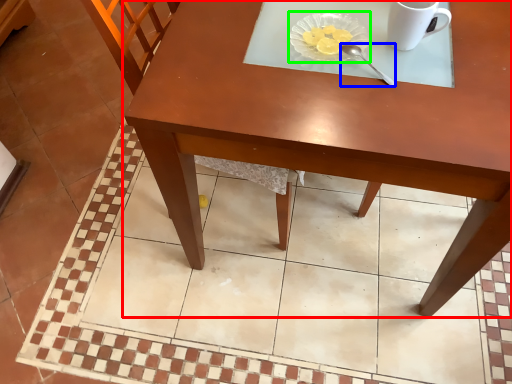
Question: Which object is the closest to the table (highlighted by a red box)? Choose among these: spoon (highlighted by a blue box) or glass plate (highlighted by a green box).

Choices:
 (A) spoon
 (B) glass plate

Answer: (B)